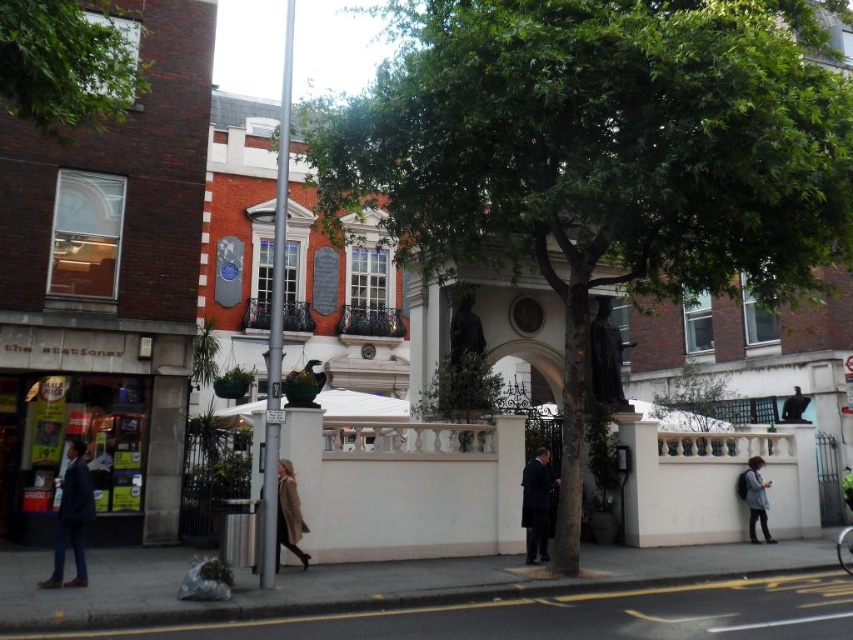
You are a tour guide leading a group to the entrance of the historic building. You notice two visitors wearing a dark suit at center and a brown wool coat at center. Which visitor is wearing a larger clothing item?

The dark suit at center has a larger size compared to the brown wool coat at center, so the visitor wearing the dark suit at center is wearing the larger clothing item.

You are standing in front of the historic building and want to determine the relative positions of two points marked on the gate. Which point is closer to you, point (608, 349) or point (846, 477)?

Point (608, 349) is further to the viewer than point (846, 477), so point (846, 477) is closer to you.